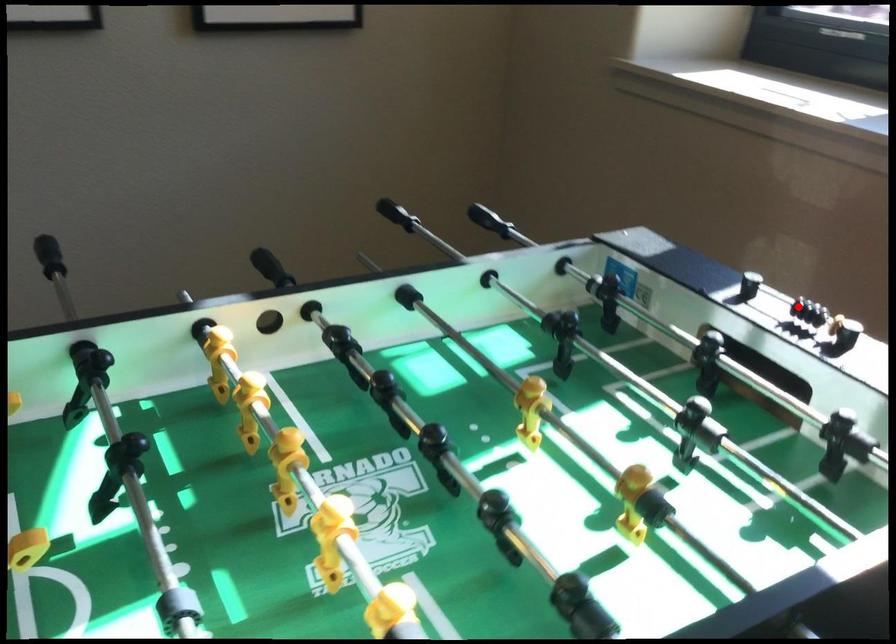
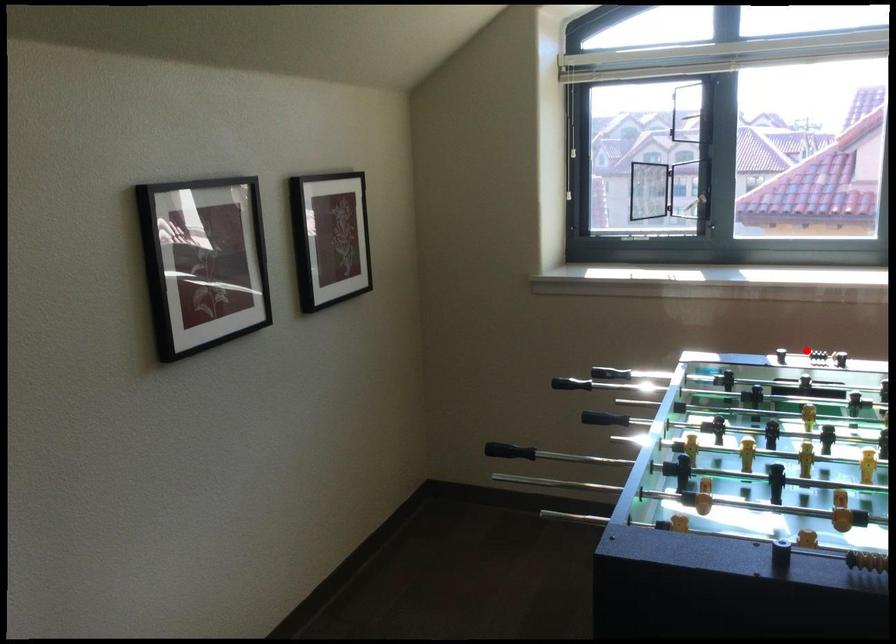
I am providing you with two images of the same scene from different viewpoints. A red point is marked on the first image and another point is marked on the second image. Does the point marked in image1 correspond to the same location as the one in image2?

Yes